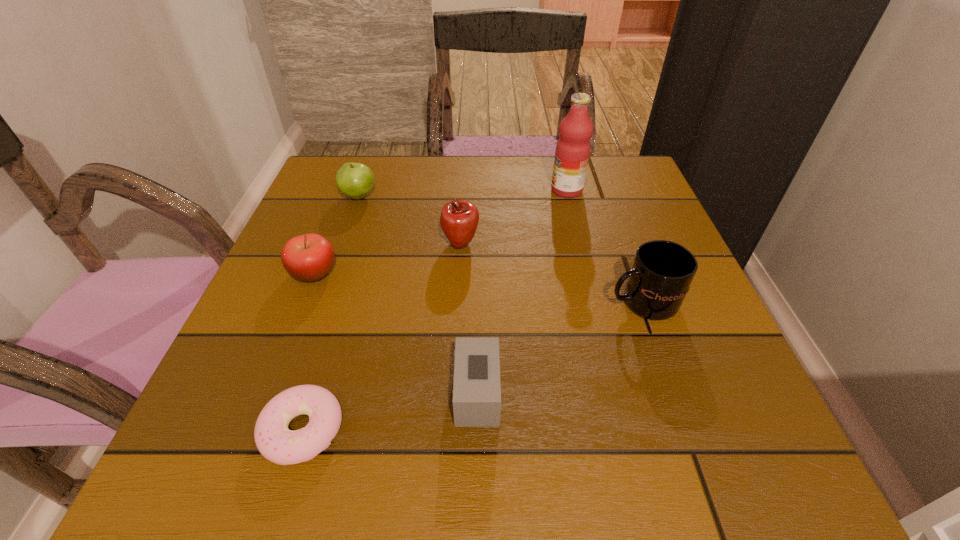
In the image, there is a desktop. Identify the location of free space at the far right corner. (644, 179).

Find the location of a particular element. Image resolution: width=960 pixels, height=540 pixels. vacant position at the near right corner of the desktop is located at coordinates (729, 474).

Where is `free space between the mug and the tallest object`? The height and width of the screenshot is (540, 960). free space between the mug and the tallest object is located at coordinates (605, 246).

Locate an element on the screen. The height and width of the screenshot is (540, 960). vacant space in between the rightmost apple and the mug is located at coordinates (551, 273).

I want to click on free space between the mug and the alarm clock, so click(x=560, y=348).

The height and width of the screenshot is (540, 960). What are the coordinates of `empty location between the sixth tallest object and the mug` in the screenshot? It's located at (560, 348).

Locate an element on the screen. The width and height of the screenshot is (960, 540). free space that is in between the farthest apple and the shortest object is located at coordinates (331, 313).

I want to click on free point between the doughnut and the farthest apple, so click(x=331, y=313).

The width and height of the screenshot is (960, 540). I want to click on free space between the doughnut and the rightmost apple, so click(381, 337).

In order to click on vacant area that lies between the rightmost apple and the shortest object in this screenshot , I will do [381, 337].